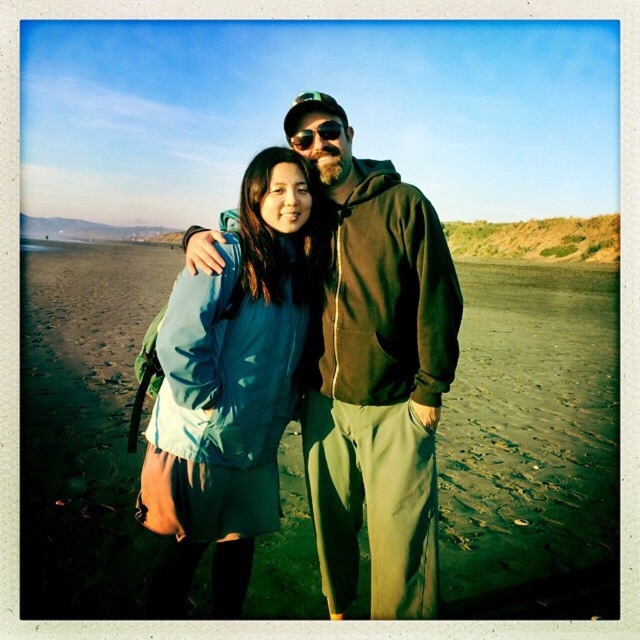
Question: Observing the image, what is the correct spatial positioning of green matte jacket at center in reference to teal fabric jacket at center?

Choices:
 (A) right
 (B) left

Answer: (A)

Question: Which of the following is the farthest from the observer?

Choices:
 (A) green matte jacket at center
 (B) green sand at center

Answer: (B)

Question: Is teal fabric jacket at center below sunglasses at center?

Choices:
 (A) no
 (B) yes

Answer: (B)

Question: Estimate the real-world distances between objects in this image. Which object is closer to the green sand at center?

Choices:
 (A) teal fabric jacket at center
 (B) green matte jacket at center
 (C) sunglasses at center

Answer: (A)

Question: Which point is closer to the camera?

Choices:
 (A) green matte jacket at center
 (B) green sand at center

Answer: (A)

Question: Can you confirm if green sand at center is positioned to the right of sunglasses at center?

Choices:
 (A) yes
 (B) no

Answer: (B)